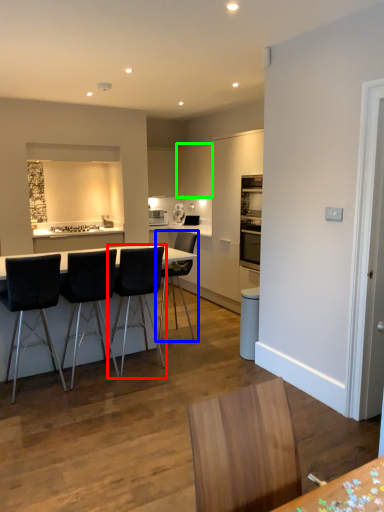
Question: Based on their relative distances, which object is nearer to chair (highlighted by a red box)? Choose from chair (highlighted by a blue box) and cabinetry (highlighted by a green box).

Choices:
 (A) chair
 (B) cabinetry

Answer: (A)